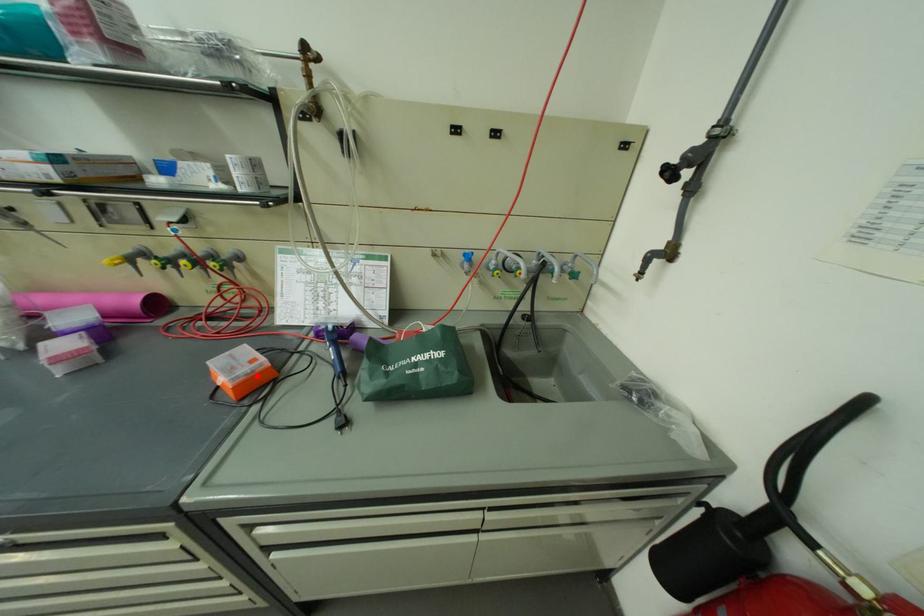
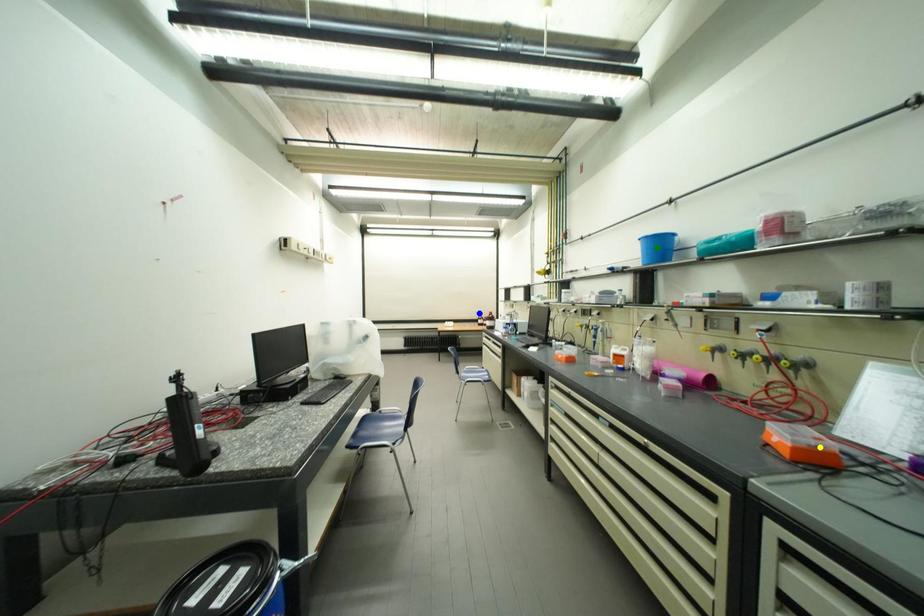
Question: I am providing you with two images of the same scene from different viewpoints. A red point is marked on the first image. You are given multiple points on the second image. Which point in image 2 represents the same 3d spot as the red point in image 1?

Choices:
 (A) yellow point
 (B) blue point
 (C) green point

Answer: (A)